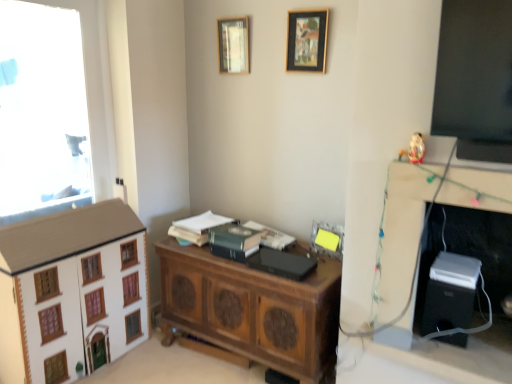
In order to click on green matte book at center, acting as the second book starting from the right in this screenshot , I will do `click(271, 236)`.

This screenshot has height=384, width=512. Identify the location of matte plastic picture frame at center, which is the 1th picture frame from right to left. (327, 239).

What do you see at coordinates (71, 292) in the screenshot?
I see `white wood dresser at lower left` at bounding box center [71, 292].

What is the approximate height of green matte book at center, which is the 2th book in left-to-right order?

The height of green matte book at center, which is the 2th book in left-to-right order, is 5.39 inches.

The image size is (512, 384). What are the coordinates of `black plastic computer desk at right` in the screenshot? It's located at (448, 353).

At what (x,y) coordinates should I click in order to perform the action: click on green matte book at center, the 3th book in the left-to-right sequence. Please return your answer as a coordinate pair (x, y). Looking at the image, I should click on (271, 236).

Measure the distance from transparent glass window at upper left to black matte book at center, positioned as the fourth book in left-to-right order.

A distance of 1.51 meters exists between transparent glass window at upper left and black matte book at center, positioned as the fourth book in left-to-right order.

Does transparent glass window at upper left lie in front of black matte book at center, acting as the first book starting from the right?

Yes, transparent glass window at upper left is in front of black matte book at center, acting as the first book starting from the right.

How different are the orientations of transparent glass window at upper left and black matte book at center, positioned as the fourth book in left-to-right order, in degrees?

90.7 degrees separate the facing orientations of transparent glass window at upper left and black matte book at center, positioned as the fourth book in left-to-right order.

The height and width of the screenshot is (384, 512). Identify the location of window in front of the black matte book at center, positioned as the fourth book in left-to-right order. (54, 108).

From a real-world perspective, is black plastic computer desk at right physically above green matte book at center, which is counted as the third book, starting from the right?

Yes.

Considering the sizes of objects black plastic computer desk at right and green matte book at center, which is the 2th book in left-to-right order, in the image provided, who is thinner, black plastic computer desk at right or green matte book at center, which is the 2th book in left-to-right order,?

With smaller width is green matte book at center, which is the 2th book in left-to-right order.

Is black plastic computer desk at right further to the viewer compared to green matte book at center, which is the 2th book in left-to-right order?

No, black plastic computer desk at right is closer to the camera.

Is black plastic computer desk at right surrounding green matte book at center, which is counted as the third book, starting from the right?

No, green matte book at center, which is counted as the third book, starting from the right, is not surrounded by black plastic computer desk at right.

Is white wood dresser at lower left located outside matte plastic picture frame at center, which is the first picture frame in bottom-to-top order?

Yes.

Considering the sizes of white wood dresser at lower left and matte plastic picture frame at center, which is the 1th picture frame from right to left, in the image, is white wood dresser at lower left wider or thinner than matte plastic picture frame at center, which is the 1th picture frame from right to left,?

white wood dresser at lower left is wider than matte plastic picture frame at center, which is the 1th picture frame from right to left.

Is point (91, 215) closer or farther from the camera than point (331, 230)?

Point (91, 215) is positioned closer to the camera compared to point (331, 230).

Is white wood dresser at lower left at the back of transparent glass window at upper left?

No, white wood dresser at lower left is not at the back of transparent glass window at upper left.

Considering the relative sizes of transparent glass window at upper left and white wood dresser at lower left in the image provided, is transparent glass window at upper left taller than white wood dresser at lower left?

Yes, transparent glass window at upper left is taller than white wood dresser at lower left.

From the picture: Which object is positioned more to the left, transparent glass window at upper left or white wood dresser at lower left?

transparent glass window at upper left is more to the left.

Based on the photo, which object is closer to the camera, transparent glass window at upper left or white wood dresser at lower left?

white wood dresser at lower left is closer to the camera.

Which object is positioned more to the right, green matte book at center, which is counted as the third book, starting from the right, or wooden picture frame at upper center, placed as the 2th picture frame when sorted from top to bottom?

wooden picture frame at upper center, placed as the 2th picture frame when sorted from top to bottom, is more to the right.

Is green matte book at center, which is the 2th book in left-to-right order, not inside wooden picture frame at upper center, placed as the 2th picture frame when sorted from top to bottom?

Yes.

Considering their positions, is green matte book at center, which is counted as the third book, starting from the right, located in front of or behind wooden picture frame at upper center, acting as the 2th picture frame starting from the bottom?

Visually, green matte book at center, which is counted as the third book, starting from the right, is located in front of wooden picture frame at upper center, acting as the 2th picture frame starting from the bottom.

The image size is (512, 384). In order to click on dresser above the wooden chest at center (from a real-world perspective) in this screenshot , I will do `click(71, 292)`.

Considering the sizes of objects wooden chest at center and white wood dresser at lower left in the image provided, who is smaller, wooden chest at center or white wood dresser at lower left?

With smaller size is white wood dresser at lower left.

Is wooden chest at center shorter than white wood dresser at lower left?

Yes, wooden chest at center is shorter than white wood dresser at lower left.

From the image's perspective, would you say wooden chest at center is shown under white wood dresser at lower left?

Yes, from the image's perspective, wooden chest at center is below white wood dresser at lower left.

Relative to transparent glass window at upper left, is green matte book at center, placed as the first book when sorted from left to right, in front or behind?

Clearly, green matte book at center, placed as the first book when sorted from left to right, is behind transparent glass window at upper left.

Considering the sizes of green matte book at center, placed as the first book when sorted from left to right, and transparent glass window at upper left in the image, is green matte book at center, placed as the first book when sorted from left to right, taller or shorter than transparent glass window at upper left?

Clearly, green matte book at center, placed as the first book when sorted from left to right, is shorter compared to transparent glass window at upper left.

Consider the image. Is green matte book at center, placed as the first book when sorted from left to right, far from transparent glass window at upper left?

Yes, green matte book at center, placed as the first book when sorted from left to right, is far from transparent glass window at upper left.

Where is `window on the left of black matte book at center, acting as the first book starting from the right`? Image resolution: width=512 pixels, height=384 pixels. window on the left of black matte book at center, acting as the first book starting from the right is located at coordinates (54, 108).

The height and width of the screenshot is (384, 512). There is a black plastic computer desk at right. Identify the location of the 2nd book below it (from the image's perspective). (234, 241).

Estimate the real-world distances between objects in this image. Which object is further from matte glass picture frame at upper center, which appears as the third picture frame when ordered from the bottom, white wood dresser at lower left or black plastic computer desk at right?

black plastic computer desk at right is further to matte glass picture frame at upper center, which appears as the third picture frame when ordered from the bottom.

From the image, which object appears to be nearer to black plastic computer desk at right, green matte book at center, which is the fourth book in right-to-left order, or wooden picture frame at upper center, the 2th picture frame when ordered from right to left?

wooden picture frame at upper center, the 2th picture frame when ordered from right to left, is positioned closer to the anchor black plastic computer desk at right.

From the image, which object appears to be farther from matte plastic picture frame at center, which is counted as the 3th picture frame, starting from the left, matte glass picture frame at upper center, which appears as the third picture frame when ordered from the bottom, or white wood dresser at lower left?

The object further to matte plastic picture frame at center, which is counted as the 3th picture frame, starting from the left, is white wood dresser at lower left.

When comparing their distances from wooden picture frame at upper center, the second picture frame when ordered from left to right, does black plastic computer desk at right or matte plastic picture frame at center, which is counted as the 3th picture frame, starting from the left, seem further?

black plastic computer desk at right is further to wooden picture frame at upper center, the second picture frame when ordered from left to right.

Consider the image. Estimate the real-world distances between objects in this image. Which object is further from wooden chest at center, matte plastic picture frame at center, which appears as the 3th picture frame when viewed from the top, or green matte book at center, which is counted as the third book, starting from the right?

Among the two, matte plastic picture frame at center, which appears as the 3th picture frame when viewed from the top, is located further to wooden chest at center.

When comparing their distances from matte glass picture frame at upper center, which is counted as the 1th picture frame, starting from the top, does wooden chest at center or black plastic speaker at lower right seem closer?

wooden chest at center is positioned closer to the anchor matte glass picture frame at upper center, which is counted as the 1th picture frame, starting from the top.

When comparing their distances from wooden chest at center, does wooden picture frame at upper center, the 2th picture frame when ordered from right to left, or black plastic speaker at lower right seem closer?

The object closer to wooden chest at center is black plastic speaker at lower right.

Which object lies further to the anchor point green matte book at center, placed as the first book when sorted from left to right, black plastic computer desk at right or black matte book at center, positioned as the fourth book in left-to-right order?

Based on the image, black plastic computer desk at right appears to be further to green matte book at center, placed as the first book when sorted from left to right.

Where is `toy that lies between wooden picture frame at upper center, the second picture frame when ordered from left to right, and black plastic speaker at lower right from top to bottom`? toy that lies between wooden picture frame at upper center, the second picture frame when ordered from left to right, and black plastic speaker at lower right from top to bottom is located at coordinates (414, 149).

Locate an element on the screen. toy situated between white wood dresser at lower left and black plastic computer desk at right from left to right is located at coordinates (414, 149).

Locate an element on the screen. The height and width of the screenshot is (384, 512). picture frame situated between transparent glass window at upper left and black matte book at center, acting as the first book starting from the right, from left to right is located at coordinates (233, 45).

This screenshot has height=384, width=512. Identify the location of toy positioned between black plastic computer desk at right and green matte book at center, the 3th book in the left-to-right sequence, from near to far. (414, 149).